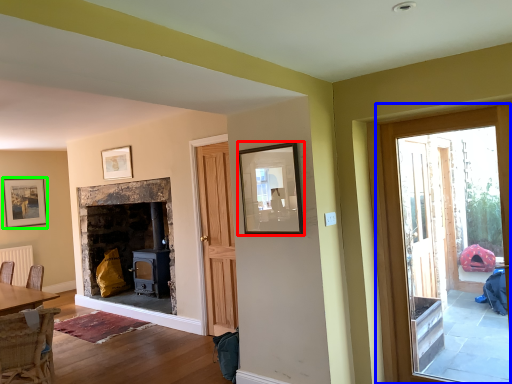
Question: Which object is the farthest from picture frame (highlighted by a red box)? Choose among these: door (highlighted by a blue box) or picture frame (highlighted by a green box).

Choices:
 (A) door
 (B) picture frame

Answer: (B)